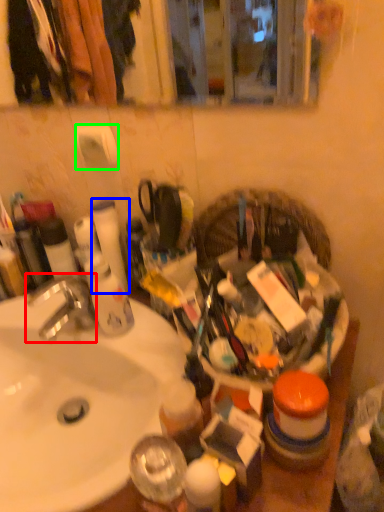
Question: Based on their relative distances, which object is nearer to faucet (highlighted by a red box)? Choose from toilet paper (highlighted by a blue box) and toilet paper (highlighted by a green box).

Choices:
 (A) toilet paper
 (B) toilet paper

Answer: (A)